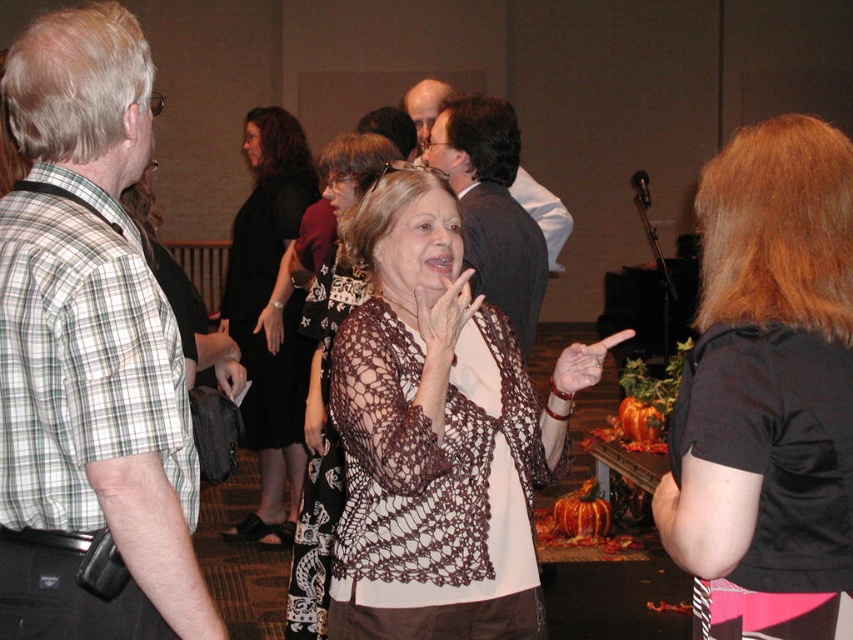
Question: Based on their relative distances, which object is farther from the black fabric shirt at right?

Choices:
 (A) matte brown hand at center
 (B) smooth bald head at center

Answer: (B)

Question: Which object is closer to the camera taking this photo?

Choices:
 (A) crochet-patterned shawl at center
 (B) white lace glove at center

Answer: (A)

Question: Can you confirm if crochet-patterned sweater at center is positioned above black lace shawl at center?

Choices:
 (A) no
 (B) yes

Answer: (A)

Question: Can you confirm if black lace shawl at center is positioned above leather bracelet at upper center?

Choices:
 (A) yes
 (B) no

Answer: (A)

Question: Is crochet-patterned sweater at center to the left of leather bracelet at upper center from the viewer's perspective?

Choices:
 (A) no
 (B) yes

Answer: (A)

Question: Which point appears farthest from the camera in this image?

Choices:
 (A) (572, 381)
 (B) (318, 403)
 (C) (413, 124)

Answer: (C)